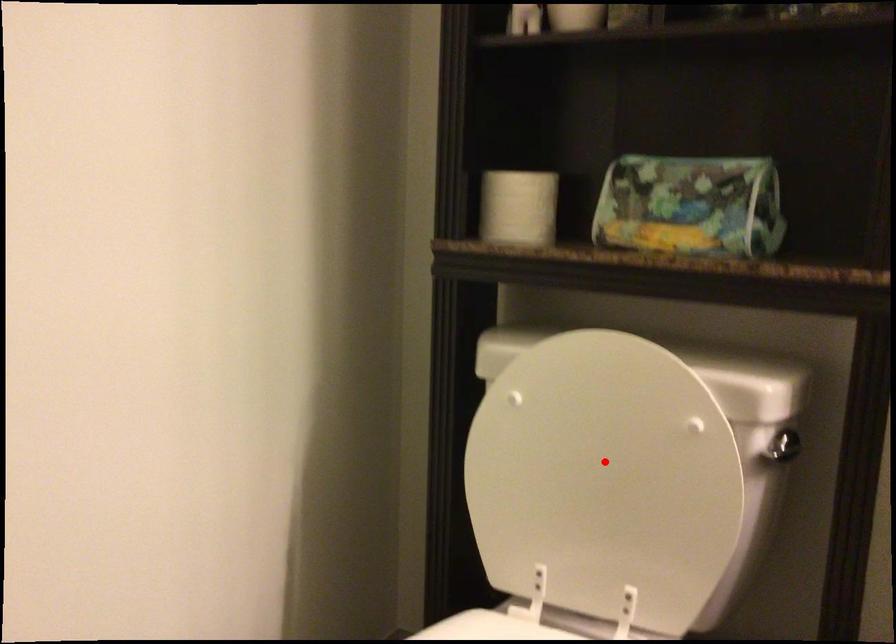
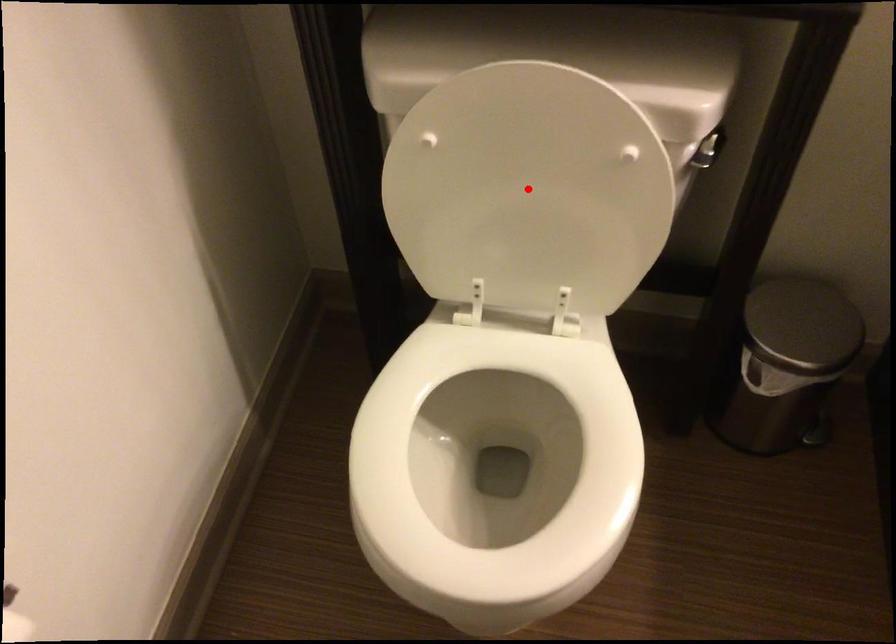
I am providing you with two images of the same scene from different viewpoints. A red point is marked on the first image and another point is marked on the second image. Does the point marked in image1 correspond to the same location as the one in image2?

Yes